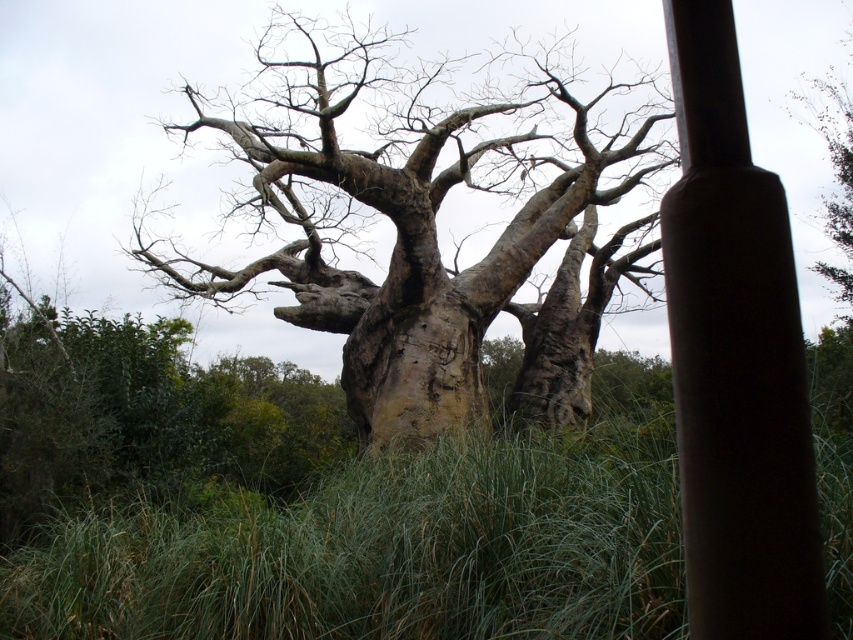
Question: Can you confirm if green grassy at center is wider than smooth brown pole at right?

Choices:
 (A) no
 (B) yes

Answer: (B)

Question: Which object is positioned closest to the smooth brown pole at right?

Choices:
 (A) green grassy at center
 (B) smooth bark tree at center

Answer: (A)

Question: Is smooth bark tree at center above smooth brown pole at right?

Choices:
 (A) no
 (B) yes

Answer: (B)

Question: Which object appears farthest from the camera in this image?

Choices:
 (A) green grassy at center
 (B) smooth bark tree at center

Answer: (B)

Question: Considering the real-world distances, which object is farthest from the smooth brown pole at right?

Choices:
 (A) green grassy at center
 (B) smooth bark tree at center

Answer: (B)

Question: Is green grassy at center bigger than smooth brown pole at right?

Choices:
 (A) no
 (B) yes

Answer: (A)